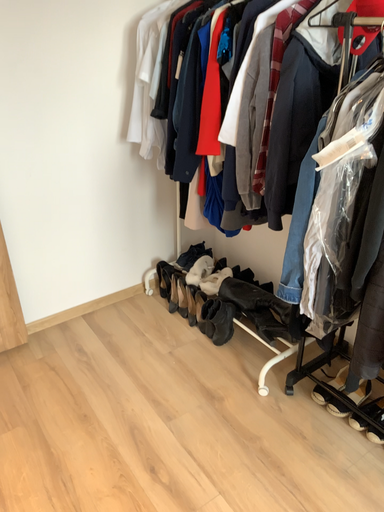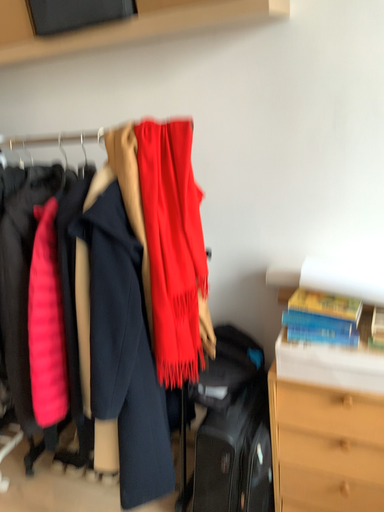
Question: How did the camera likely rotate when shooting the video?

Choices:
 (A) rotated downward
 (B) rotated upward

Answer: (B)